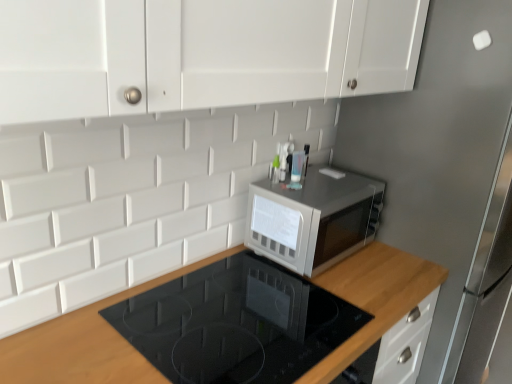
This screenshot has width=512, height=384. Describe the element at coordinates (448, 176) in the screenshot. I see `satin silver fridge at upper right` at that location.

Measure the distance between point (465,138) and camera.

They are 1.40 meters apart.

Identify the location of satin silver microwave at center. Image resolution: width=512 pixels, height=384 pixels. (313, 219).

Is wooden at upper right to the right of satin silver microwave at center from the viewer's perspective?

No, wooden at upper right is not to the right of satin silver microwave at center.

Which of these two, wooden at upper right or satin silver microwave at center, is wider?

wooden at upper right.

Does wooden at upper right come behind satin silver microwave at center?

No, wooden at upper right is closer to the viewer.

Locate an element on the screen. The height and width of the screenshot is (384, 512). microwave oven above the satin silver fridge at upper right (from the image's perspective) is located at coordinates (313, 219).

Based on the photo, considering the sizes of objects satin silver microwave at center and satin silver fridge at upper right in the image provided, who is shorter, satin silver microwave at center or satin silver fridge at upper right?

satin silver microwave at center is shorter.

Which is further, [307,192] or [425,118]?

The point [425,118] is farther from the camera.

Is satin silver microwave at center with wooden at upper right?

satin silver microwave at center and wooden at upper right are not in contact.

Is satin silver microwave at center taller than wooden at upper right?

No.

Considering the sizes of satin silver microwave at center and wooden at upper right in the image, is satin silver microwave at center wider or thinner than wooden at upper right?

Clearly, satin silver microwave at center has less width compared to wooden at upper right.

From a real-world perspective, is satin silver microwave at center on top of wooden at upper right?

Yes, from a real-world perspective, satin silver microwave at center is on top of wooden at upper right.

Is wooden at upper right located outside satin silver fridge at upper right?

That's correct, wooden at upper right is outside of satin silver fridge at upper right.

In terms of width, does wooden at upper right look wider or thinner when compared to satin silver fridge at upper right?

Considering their sizes, wooden at upper right looks slimmer than satin silver fridge at upper right.

In the scene shown: Which object is positioned more to the right, wooden at upper right or satin silver fridge at upper right?

Positioned to the right is satin silver fridge at upper right.

Could you tell me if wooden at upper right is turned towards satin silver fridge at upper right?

No, wooden at upper right is not turned towards satin silver fridge at upper right.

From a real-world perspective, is satin silver fridge at upper right physically above wooden at upper right?

Yes, from a real-world perspective, satin silver fridge at upper right is over wooden at upper right

Is satin silver fridge at upper right beside wooden at upper right?

There is a gap between satin silver fridge at upper right and wooden at upper right.

Is satin silver fridge at upper right at the right side of wooden at upper right?

Yes.

Based on the photo, from the image's perspective, does satin silver fridge at upper right appear lower than wooden at upper right?

No, from the image's perspective, satin silver fridge at upper right is not below wooden at upper right.

From a real-world perspective, which is physically below, satin silver fridge at upper right or satin silver microwave at center?

In real-world perspective, satin silver fridge at upper right is lower.

The height and width of the screenshot is (384, 512). Identify the location of fridge that appears in front of the satin silver microwave at center. (448, 176).

From the image's perspective, is satin silver fridge at upper right on top of satin silver microwave at center?

No, from the image's perspective, satin silver fridge at upper right is not on top of satin silver microwave at center.

Is satin silver fridge at upper right not near satin silver microwave at center?

satin silver fridge at upper right is near satin silver microwave at center, not far away.

Image resolution: width=512 pixels, height=384 pixels. Find the location of `countertop below the satin silver microwave at center (from the image's perspective)`. countertop below the satin silver microwave at center (from the image's perspective) is located at coordinates [84, 344].

Image resolution: width=512 pixels, height=384 pixels. Identify the location of fridge below the satin silver microwave at center (from a real-world perspective). (448, 176).

From the image, which object appears to be nearer to wooden at upper right, satin silver microwave at center or satin silver fridge at upper right?

satin silver microwave at center.

When comparing their distances from satin silver microwave at center, does wooden at upper right or satin silver fridge at upper right seem closer?

wooden at upper right is positioned closer to the anchor satin silver microwave at center.

Looking at the image, which one is located further to satin silver fridge at upper right, satin silver microwave at center or wooden at upper right?

Among the two, wooden at upper right is located further to satin silver fridge at upper right.

Considering their positions, is satin silver fridge at upper right positioned closer to wooden at upper right than satin silver microwave at center?

Among the two, satin silver microwave at center is located nearer to wooden at upper right.

Based on their spatial positions, is satin silver fridge at upper right or wooden at upper right further from satin silver microwave at center?

Based on the image, satin silver fridge at upper right appears to be further to satin silver microwave at center.

Which object lies further to the anchor point satin silver fridge at upper right, wooden at upper right or satin silver microwave at center?

Among the two, wooden at upper right is located further to satin silver fridge at upper right.

The height and width of the screenshot is (384, 512). Identify the location of microwave oven between wooden at upper right and satin silver fridge at upper right from left to right. (313, 219).